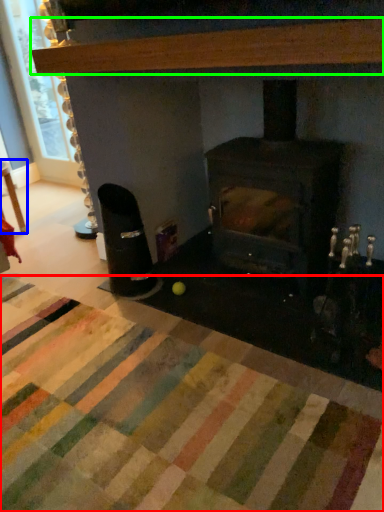
Question: Which is farther away from mat (highlighted by a red box)? table (highlighted by a blue box) or hardwood (highlighted by a green box)?

Choices:
 (A) table
 (B) hardwood

Answer: (A)